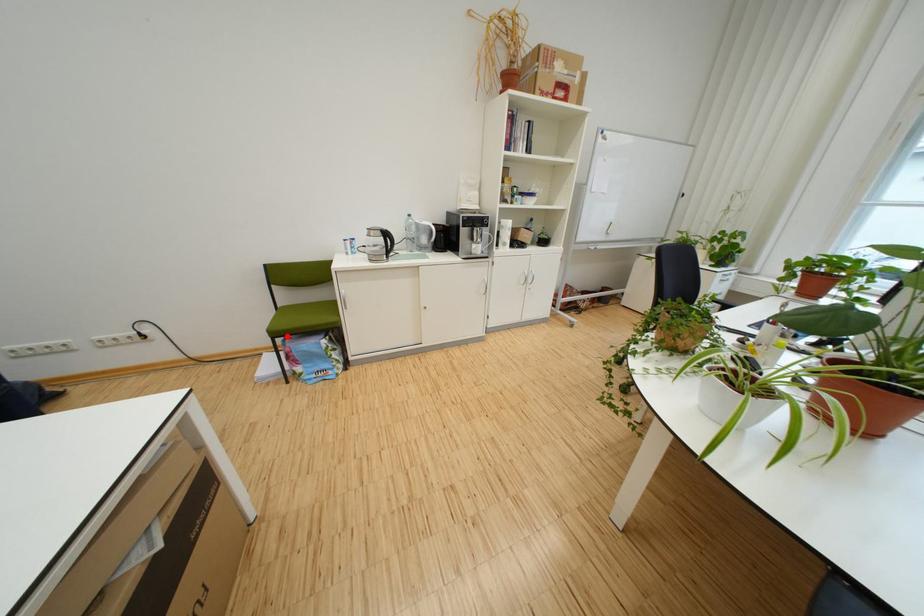
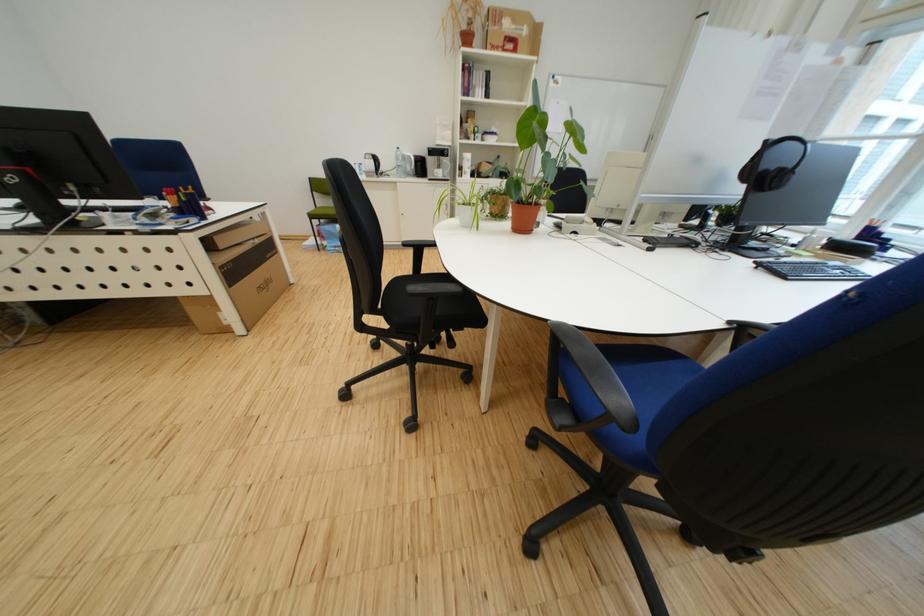
Find the pixel in the second image that matches the highlighted location in the first image.

(323, 219)